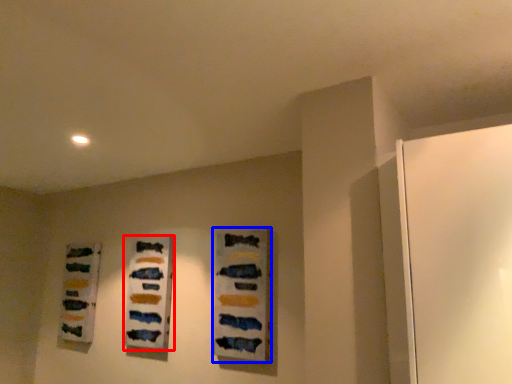
Question: Which object appears farthest to the camera in this image, art (highlighted by a red box) or art (highlighted by a blue box)?

Choices:
 (A) art
 (B) art

Answer: (A)